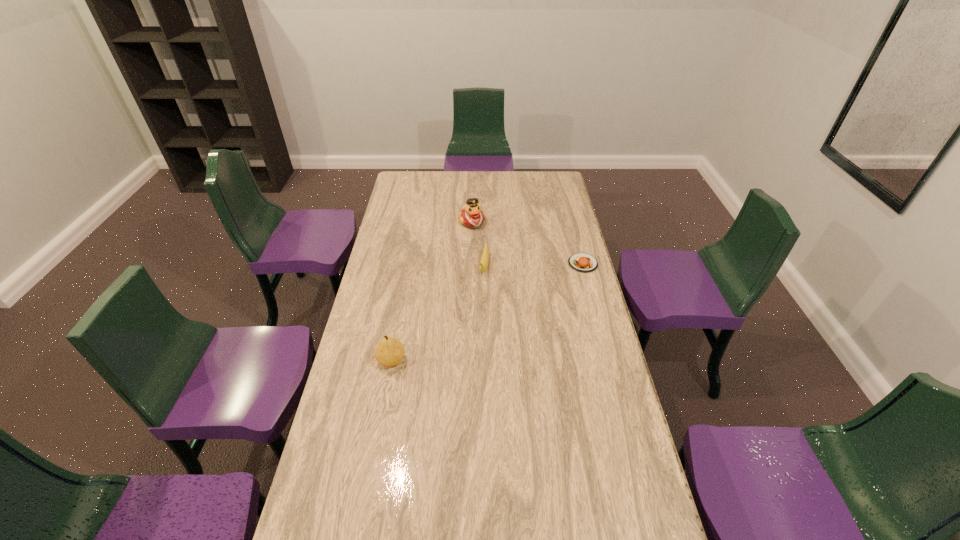
Identify which object is the second closest to the rightmost object. Please provide its 2D coordinates. Your answer should be formatted as a tuple, i.e. [(x, y)], where the tuple contains the x and y coordinates of a point satisfying the conditions above.

[(471, 215)]

You are a GUI agent. You are given a task and a screenshot of the screen. Output one action in this format:
    pyautogui.click(x=<x>, y=<y>)
    Task: Click on the object that is the third closest one to the duck
    The height and width of the screenshot is (540, 960).
    Given the screenshot: What is the action you would take?
    pyautogui.click(x=389, y=352)

In order to click on blank area in the image that satisfies the following two spatial constraints: 1. on the back side of the second shortest object; 2. on the right side of the pear in this screenshot , I will do `click(409, 267)`.

You are a GUI agent. You are given a task and a screenshot of the screen. Output one action in this format:
    pyautogui.click(x=<x>, y=<y>)
    Task: Click on the vacant space that satisfies the following two spatial constraints: 1. on the back side of the banana; 2. on the right side of the pear
    The height and width of the screenshot is (540, 960).
    Given the screenshot: What is the action you would take?
    pyautogui.click(x=409, y=267)

At what (x,y) coordinates should I click in order to perform the action: click on blank area in the image that satisfies the following two spatial constraints: 1. on the front side of the banana; 2. on the right side of the farthest object. Please return your answer as a coordinate pair (x, y). Looking at the image, I should click on (471, 267).

The image size is (960, 540). I want to click on vacant area that satisfies the following two spatial constraints: 1. on the front side of the third tallest object; 2. on the right side of the farthest object, so click(x=471, y=267).